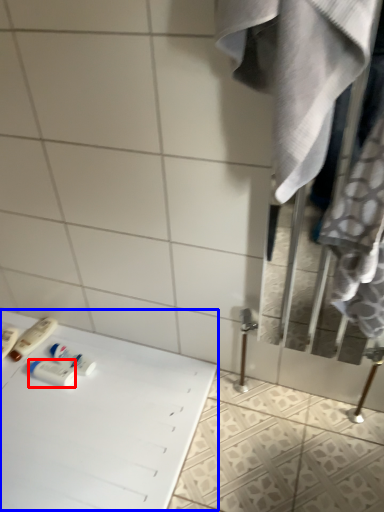
Question: Which point is closer to the camera, toiletry (highlighted by a red box) or table (highlighted by a blue box)?

Choices:
 (A) toiletry
 (B) table

Answer: (B)